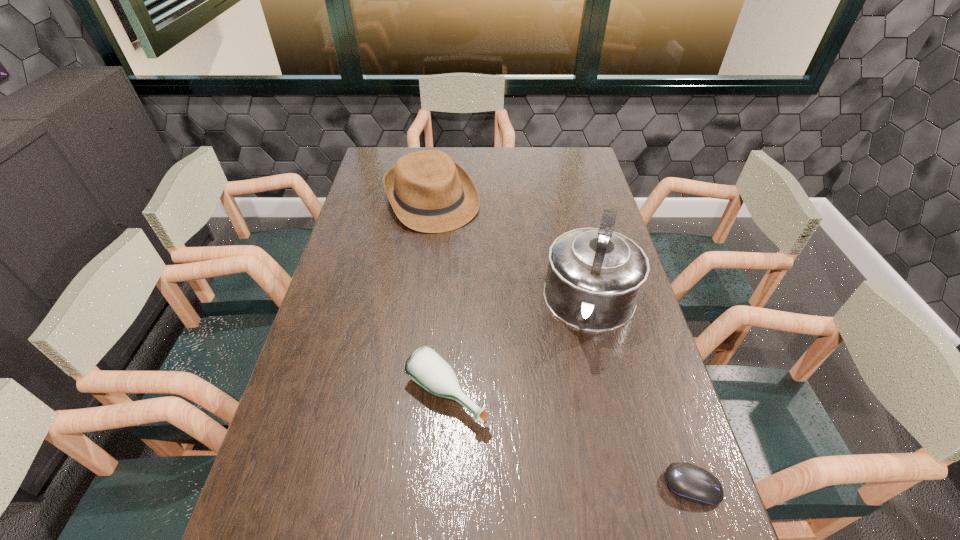
Where is `the third tallest object`? the third tallest object is located at coordinates [425, 366].

This screenshot has height=540, width=960. In order to click on the third farthest object in this screenshot , I will do `click(425, 366)`.

Find the location of a particular element. The height and width of the screenshot is (540, 960). the shortest object is located at coordinates (692, 483).

The width and height of the screenshot is (960, 540). What are the coordinates of `the nearest object` in the screenshot? It's located at (692, 483).

Locate an element on the screen. This screenshot has width=960, height=540. fedora is located at coordinates (429, 192).

Identify the location of the second tallest object. The image size is (960, 540). (429, 192).

The image size is (960, 540). Identify the location of kettle. (594, 278).

I want to click on the tallest object, so click(594, 278).

Find the location of a particular element. This screenshot has height=540, width=960. free spot located 0.180m on the back of the third tallest object is located at coordinates (451, 308).

I want to click on free space located on the left of the nearest object, so click(636, 486).